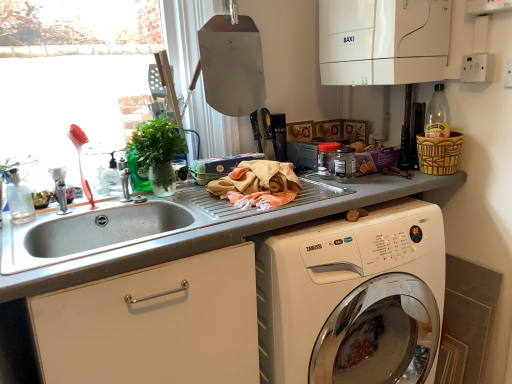
You are a GUI agent. You are given a task and a screenshot of the screen. Output one action in this format:
    pyautogui.click(x=<x>, y=<y>)
    Task: Click on the free space in front of transparent plastic jar at center, which is the second appliance from top to bottom
    The width and height of the screenshot is (512, 384).
    Given the screenshot: What is the action you would take?
    pyautogui.click(x=332, y=192)